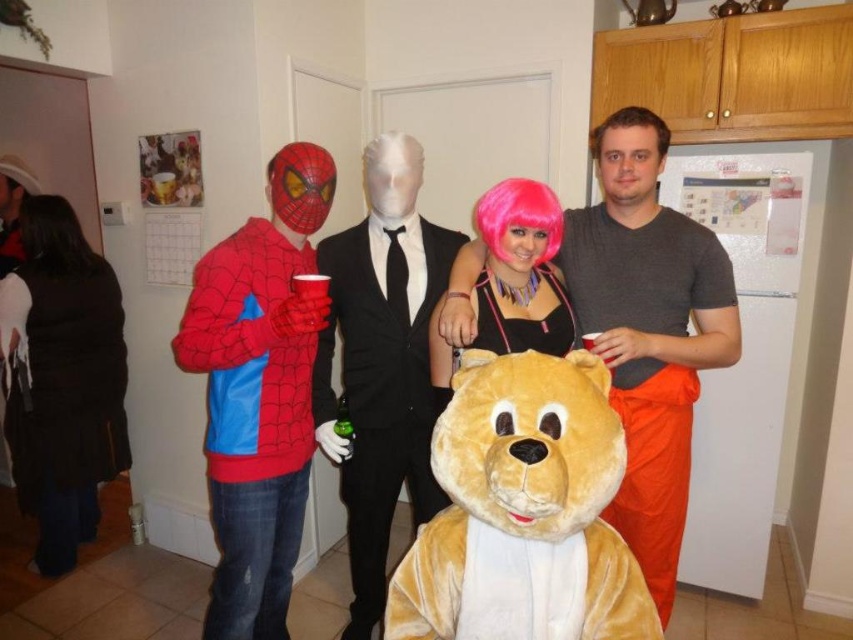
Question: Does black fuzzy vest at left appear over pink wig at center?

Choices:
 (A) no
 (B) yes

Answer: (A)

Question: Can you confirm if velvet golden bear at center is thinner than black synthetic wig at upper left?

Choices:
 (A) no
 (B) yes

Answer: (A)

Question: Which point is farther to the camera?

Choices:
 (A) shiny spandex spider-man costume at left
 (B) black fuzzy vest at left

Answer: (B)

Question: Estimate the real-world distances between objects in this image. Which object is farther from the shiny spandex spider-man costume at left?

Choices:
 (A) smooth black suit at center
 (B) black fuzzy vest at left
 (C) matte gray t-shirt at center
 (D) black synthetic wig at upper left

Answer: (D)

Question: Which object is positioned farthest from the pink synthetic wig at center?

Choices:
 (A) smooth black suit at center
 (B) pink wig at center
 (C) matte gray t-shirt at center
 (D) black fuzzy vest at left

Answer: (D)

Question: Is shiny spandex spider-man costume at left positioned behind black synthetic wig at upper left?

Choices:
 (A) no
 (B) yes

Answer: (A)